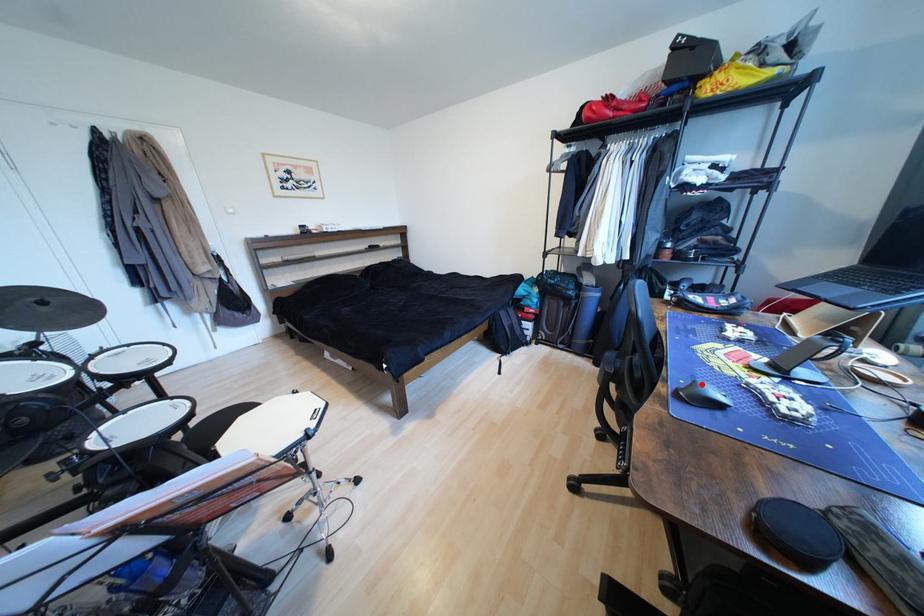
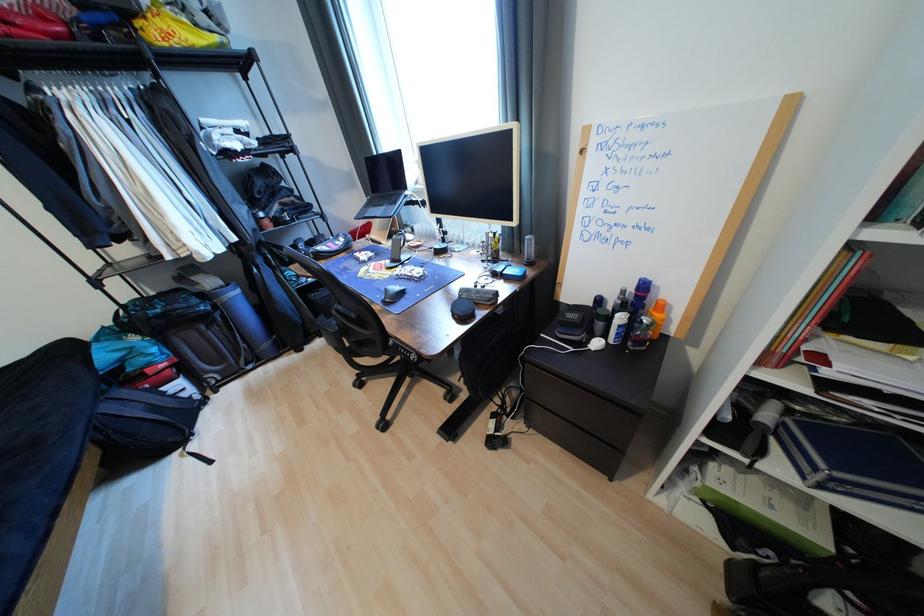
The point at the highlighted location is marked in the first image. Where is the corresponding point in the second image?

(393, 292)